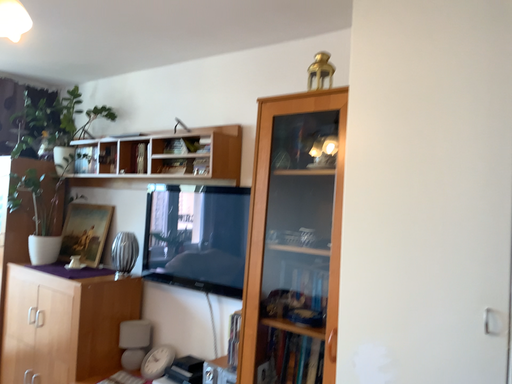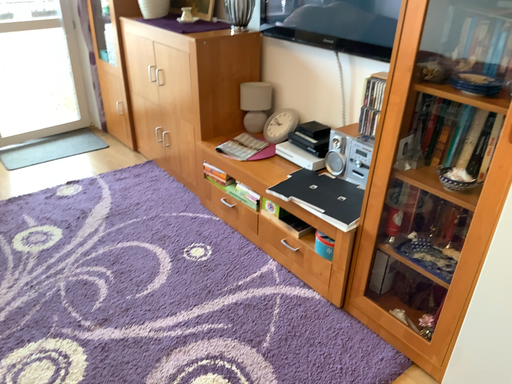
Question: Which way did the camera rotate in the video?

Choices:
 (A) rotated right
 (B) rotated left

Answer: (B)